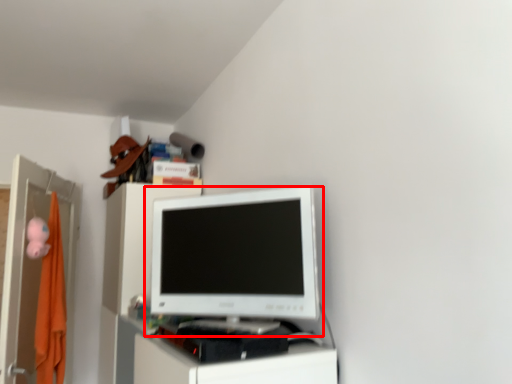
Question: From the image, what is the correct spatial relationship of computer monitor (annotated by the red box) in relation to file cabinet?

Choices:
 (A) right
 (B) left

Answer: (A)